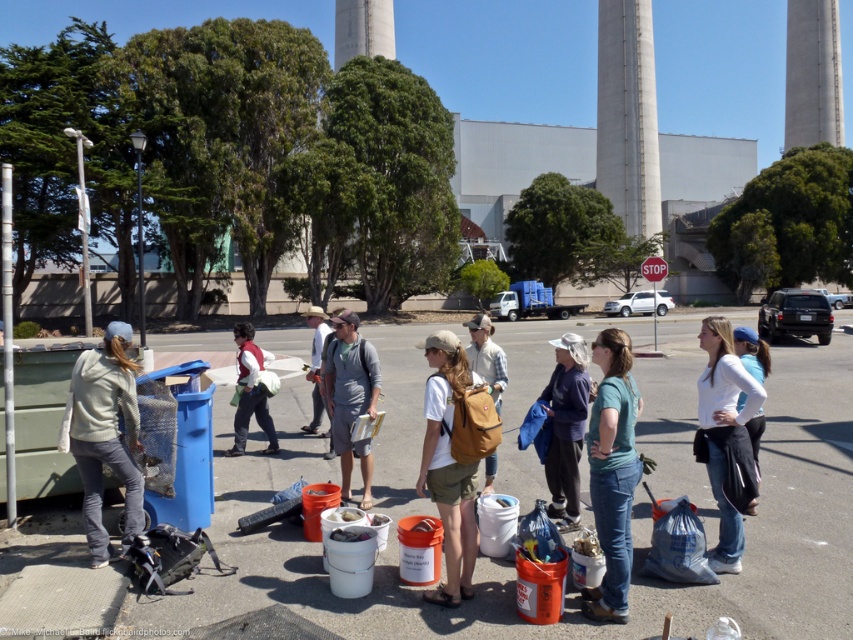
Question: In this image, where is matte teal shirt at center located relative to gray concrete tower at upper right?

Choices:
 (A) below
 (B) above

Answer: (A)

Question: Estimate the real-world distances between objects in this image. Which object is closer to the brown leather backpack at center?

Choices:
 (A) matte red vest at center
 (B) light gray fleece jacket at left

Answer: (B)

Question: Which of these objects is positioned closest to the gray concrete tower at upper right?

Choices:
 (A) matte red vest at center
 (B) light gray fleece jacket at left

Answer: (B)

Question: Which object appears farthest from the camera in this image?

Choices:
 (A) matte red vest at center
 (B) gray concrete tower at upper right
 (C) brown canvas backpack at center

Answer: (B)

Question: Is white cotton shirt at center closer to the viewer compared to dark blue shirt at center?

Choices:
 (A) no
 (B) yes

Answer: (B)

Question: Does light gray fleece jacket at left appear on the left side of matte red vest at center?

Choices:
 (A) no
 (B) yes

Answer: (B)